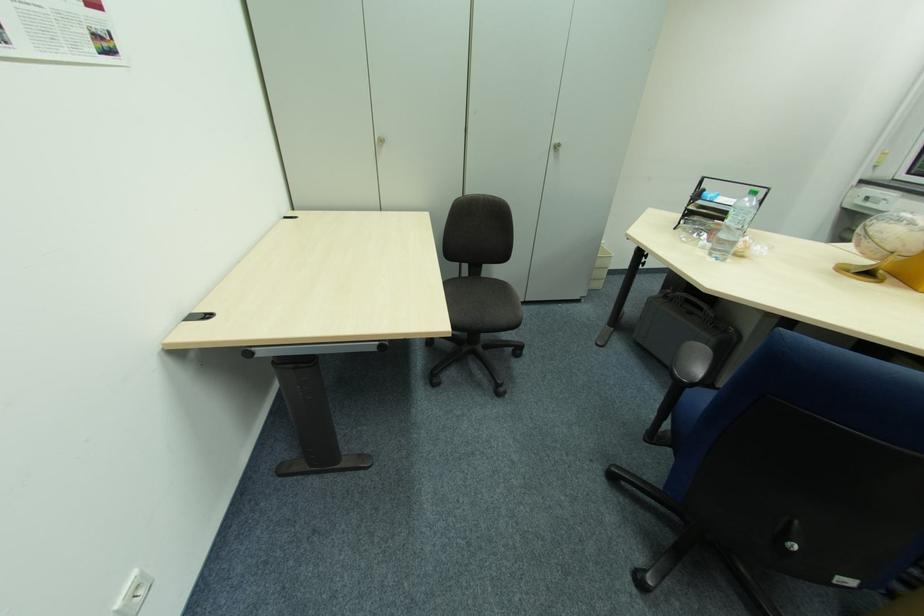
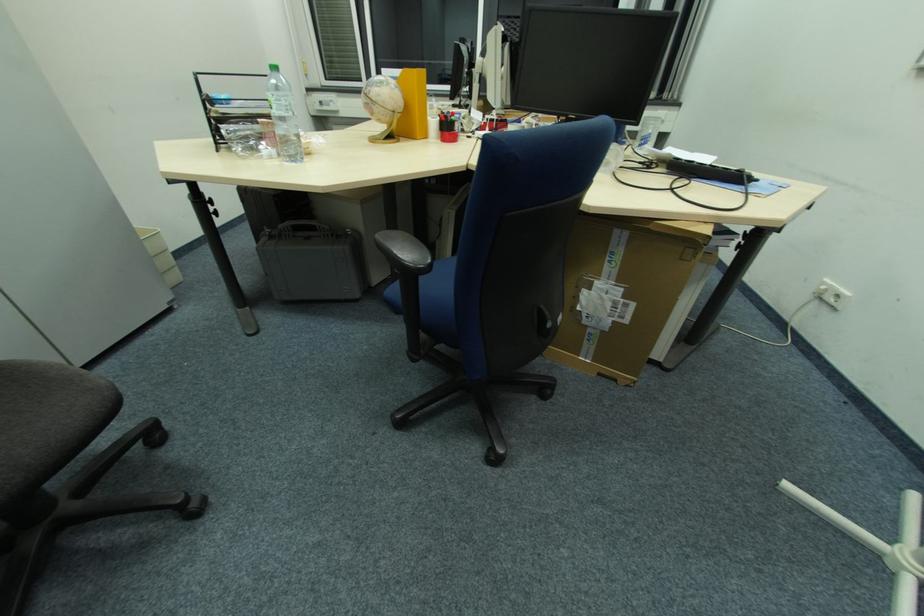
First-person continuous shooting, in which direction is the camera rotating?

The camera's rotation is toward right-down.